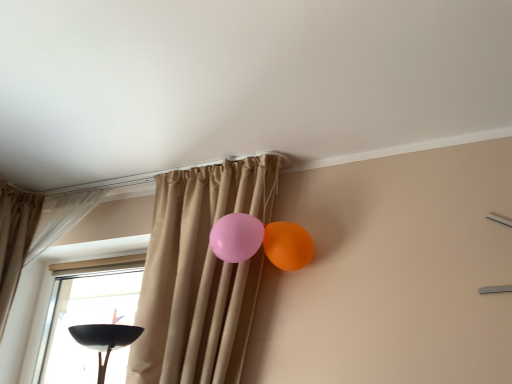
Describe the element at coordinates (287, 245) in the screenshot. This screenshot has width=512, height=384. I see `orange glossy balloon at upper right` at that location.

The height and width of the screenshot is (384, 512). In order to click on beige fabric curtain at upper left, the 1th curtain positioned from the left in this screenshot , I will do (x=61, y=218).

Measure the distance between beige fabric curtain at upper left, which appears as the 2th curtain when viewed from the right, and camera.

beige fabric curtain at upper left, which appears as the 2th curtain when viewed from the right, and camera are 2.18 meters apart from each other.

Find the location of a particular element. This screenshot has height=384, width=512. beige fabric curtain at center, acting as the 1th curtain starting from the right is located at coordinates (199, 275).

This screenshot has width=512, height=384. In order to click on orange glossy balloon at upper right in this screenshot , I will do `click(287, 245)`.

In order to click on curtain located on the left of beige fabric curtain at center, marked as the second curtain in a left-to-right arrangement in this screenshot , I will do `click(61, 218)`.

Are beige fabric curtain at center, acting as the 1th curtain starting from the right, and beige fabric curtain at upper left, which appears as the 2th curtain when viewed from the right, far apart?

No, beige fabric curtain at center, acting as the 1th curtain starting from the right, is not far away from beige fabric curtain at upper left, which appears as the 2th curtain when viewed from the right.

Considering the points (174, 251) and (53, 199), which point is behind, point (174, 251) or point (53, 199)?

The point (53, 199) is farther.

Looking at this image, does beige fabric curtain at center, acting as the 1th curtain starting from the right, lie behind beige fabric curtain at upper left, the 1th curtain positioned from the left?

No, beige fabric curtain at center, acting as the 1th curtain starting from the right, is closer to the camera.

Can you confirm if beige fabric curtain at upper left, which appears as the 2th curtain when viewed from the right, is smaller than beige fabric curtain at center, acting as the 1th curtain starting from the right?

Yes, beige fabric curtain at upper left, which appears as the 2th curtain when viewed from the right, is smaller than beige fabric curtain at center, acting as the 1th curtain starting from the right.

Which object is more forward, beige fabric curtain at upper left, which appears as the 2th curtain when viewed from the right, or beige fabric curtain at center, marked as the second curtain in a left-to-right arrangement?

beige fabric curtain at center, marked as the second curtain in a left-to-right arrangement, is closer to the camera.

Consider the image. From the image's perspective, which one is positioned higher, beige fabric curtain at upper left, the 1th curtain positioned from the left, or beige fabric curtain at center, marked as the second curtain in a left-to-right arrangement?

From the image's view, beige fabric curtain at upper left, the 1th curtain positioned from the left, is above.

Which point is more forward, (76, 193) or (143, 376)?

Point (143, 376)

Looking at this image, what's the angular difference between beige fabric curtain at upper left, the 1th curtain positioned from the left, and orange glossy balloon at upper right's facing directions?

The facing directions of beige fabric curtain at upper left, the 1th curtain positioned from the left, and orange glossy balloon at upper right are 6.57 degrees apart.

Is orange glossy balloon at upper right a part of beige fabric curtain at upper left, the 1th curtain positioned from the left?

No, orange glossy balloon at upper right is not inside beige fabric curtain at upper left, the 1th curtain positioned from the left.

Considering the sizes of objects beige fabric curtain at upper left, the 1th curtain positioned from the left, and orange glossy balloon at upper right in the image provided, who is shorter, beige fabric curtain at upper left, the 1th curtain positioned from the left, or orange glossy balloon at upper right?

With less height is orange glossy balloon at upper right.

Is beige fabric curtain at upper left, which appears as the 2th curtain when viewed from the right, positioned with its back to orange glossy balloon at upper right?

No, beige fabric curtain at upper left, which appears as the 2th curtain when viewed from the right, is not facing the opposite direction of orange glossy balloon at upper right.

Visually, is orange glossy balloon at upper right positioned to the left or to the right of beige fabric curtain at center, acting as the 1th curtain starting from the right?

Clearly, orange glossy balloon at upper right is on the right of beige fabric curtain at center, acting as the 1th curtain starting from the right, in the image.

At what (x,y) coordinates should I click in order to perform the action: click on balloon behind the beige fabric curtain at center, marked as the second curtain in a left-to-right arrangement. Please return your answer as a coordinate pair (x, y). This screenshot has height=384, width=512. Looking at the image, I should click on (287, 245).

Which is closer to the camera, (292, 254) or (242, 204)?

Point (292, 254) is positioned closer to the camera compared to point (242, 204).

Is orange glossy balloon at upper right bigger than beige fabric curtain at center, marked as the second curtain in a left-to-right arrangement?

No.

Is beige fabric curtain at center, acting as the 1th curtain starting from the right, with orange glossy balloon at upper right?

No, beige fabric curtain at center, acting as the 1th curtain starting from the right, is not with orange glossy balloon at upper right.

Which of these two, beige fabric curtain at center, marked as the second curtain in a left-to-right arrangement, or orange glossy balloon at upper right, is thinner?

orange glossy balloon at upper right.

Can you confirm if beige fabric curtain at center, acting as the 1th curtain starting from the right, is positioned to the right of orange glossy balloon at upper right?

No, beige fabric curtain at center, acting as the 1th curtain starting from the right, is not to the right of orange glossy balloon at upper right.

Based on the photo, from a real-world perspective, is beige fabric curtain at center, marked as the second curtain in a left-to-right arrangement, located beneath orange glossy balloon at upper right?

Correct, in the physical world, beige fabric curtain at center, marked as the second curtain in a left-to-right arrangement, is lower than orange glossy balloon at upper right.

From a real-world perspective, who is located higher, orange glossy balloon at upper right or beige fabric curtain at upper left, which appears as the 2th curtain when viewed from the right?

beige fabric curtain at upper left, which appears as the 2th curtain when viewed from the right.

From the image's perspective, who appears lower, orange glossy balloon at upper right or beige fabric curtain at upper left, the 1th curtain positioned from the left?

orange glossy balloon at upper right, from the image's perspective.

Measure the distance between orange glossy balloon at upper right and beige fabric curtain at upper left, which appears as the 2th curtain when viewed from the right.

A distance of 1.11 meters exists between orange glossy balloon at upper right and beige fabric curtain at upper left, which appears as the 2th curtain when viewed from the right.

Considering the relative positions of orange glossy balloon at upper right and beige fabric curtain at upper left, which appears as the 2th curtain when viewed from the right, in the image provided, is orange glossy balloon at upper right to the left or to the right of beige fabric curtain at upper left, which appears as the 2th curtain when viewed from the right,?

orange glossy balloon at upper right is to the right of beige fabric curtain at upper left, which appears as the 2th curtain when viewed from the right.

At what (x,y) coordinates should I click in order to perform the action: click on curtain on the left of beige fabric curtain at center, marked as the second curtain in a left-to-right arrangement. Please return your answer as a coordinate pair (x, y). Looking at the image, I should click on (61, 218).

This screenshot has width=512, height=384. In order to click on curtain in front of the beige fabric curtain at upper left, which appears as the 2th curtain when viewed from the right in this screenshot , I will do `click(199, 275)`.

From the image, which object appears to be nearer to beige fabric curtain at center, marked as the second curtain in a left-to-right arrangement, orange glossy balloon at upper right or beige fabric curtain at upper left, which appears as the 2th curtain when viewed from the right?

orange glossy balloon at upper right lies closer to beige fabric curtain at center, marked as the second curtain in a left-to-right arrangement, than the other object.

Considering their positions, is beige fabric curtain at upper left, the 1th curtain positioned from the left, positioned further to orange glossy balloon at upper right than beige fabric curtain at center, marked as the second curtain in a left-to-right arrangement?

Among the two, beige fabric curtain at upper left, the 1th curtain positioned from the left, is located further to orange glossy balloon at upper right.

Based on their spatial positions, is beige fabric curtain at upper left, which appears as the 2th curtain when viewed from the right, or orange glossy balloon at upper right further from beige fabric curtain at center, acting as the 1th curtain starting from the right?

beige fabric curtain at upper left, which appears as the 2th curtain when viewed from the right, is positioned further to the anchor beige fabric curtain at center, acting as the 1th curtain starting from the right.

Considering their positions, is beige fabric curtain at center, acting as the 1th curtain starting from the right, positioned further to orange glossy balloon at upper right than beige fabric curtain at upper left, which appears as the 2th curtain when viewed from the right?

beige fabric curtain at upper left, which appears as the 2th curtain when viewed from the right, is further to orange glossy balloon at upper right.

Which object lies further to the anchor point beige fabric curtain at upper left, which appears as the 2th curtain when viewed from the right, orange glossy balloon at upper right or beige fabric curtain at center, marked as the second curtain in a left-to-right arrangement?

orange glossy balloon at upper right is further to beige fabric curtain at upper left, which appears as the 2th curtain when viewed from the right.

Looking at the image, which one is located closer to beige fabric curtain at upper left, which appears as the 2th curtain when viewed from the right, beige fabric curtain at center, marked as the second curtain in a left-to-right arrangement, or orange glossy balloon at upper right?

beige fabric curtain at center, marked as the second curtain in a left-to-right arrangement.

The width and height of the screenshot is (512, 384). In order to click on curtain between beige fabric curtain at upper left, which appears as the 2th curtain when viewed from the right, and orange glossy balloon at upper right in this screenshot , I will do `click(199, 275)`.